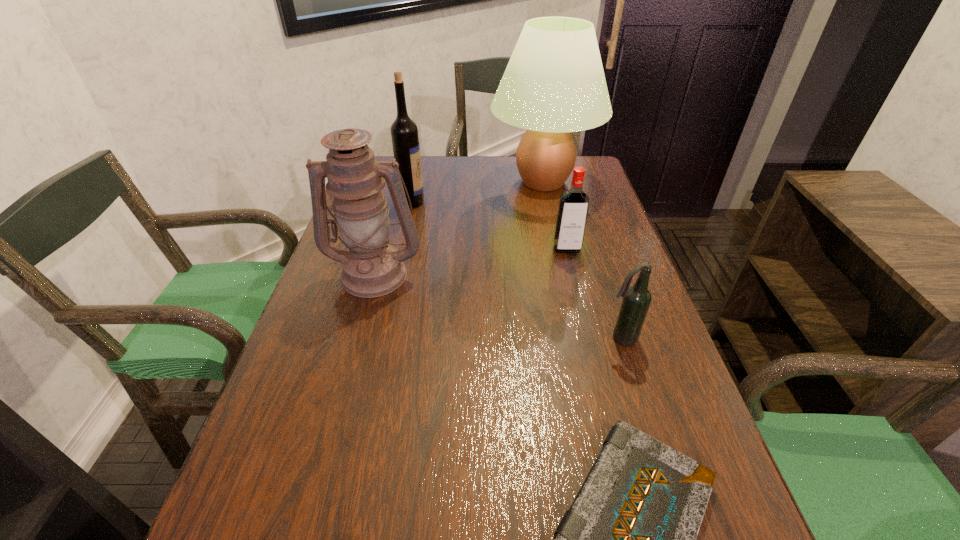
Where is `free space located 0.260m on the front and back of the vodka`? The height and width of the screenshot is (540, 960). free space located 0.260m on the front and back of the vodka is located at coordinates (587, 330).

Where is `vacant space located 0.210m on the left of the beer bottle`? The height and width of the screenshot is (540, 960). vacant space located 0.210m on the left of the beer bottle is located at coordinates (503, 338).

The height and width of the screenshot is (540, 960). What are the coordinates of `object that is at the far edge` in the screenshot? It's located at (554, 84).

At what (x,y) coordinates should I click in order to perform the action: click on wine bottle that is at the left edge. Please return your answer as a coordinate pair (x, y). The height and width of the screenshot is (540, 960). Looking at the image, I should click on (404, 132).

You are a GUI agent. You are given a task and a screenshot of the screen. Output one action in this format:
    pyautogui.click(x=<x>, y=<y>)
    Task: Click on the oil lamp located at the left edge
    The width and height of the screenshot is (960, 540).
    Given the screenshot: What is the action you would take?
    pyautogui.click(x=372, y=267)

You are a GUI agent. You are given a task and a screenshot of the screen. Output one action in this format:
    pyautogui.click(x=<x>, y=<y>)
    Task: Click on the lampshade that is at the right edge
    
    Given the screenshot: What is the action you would take?
    pyautogui.click(x=554, y=84)

Identify the location of vodka present at the right edge. (573, 207).

This screenshot has height=540, width=960. I want to click on beer bottle situated at the right edge, so click(x=636, y=301).

This screenshot has height=540, width=960. I want to click on object located in the far right corner section of the desktop, so click(554, 84).

The image size is (960, 540). In the image, there is a desktop. What are the coordinates of `vacant space at the far edge` in the screenshot? It's located at (478, 185).